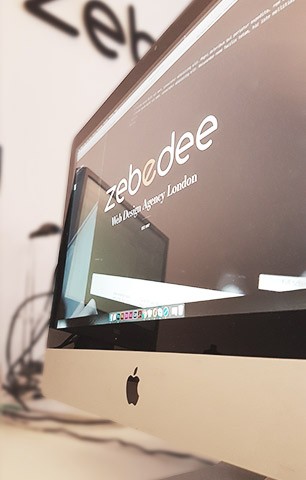
I want to click on reflection of computer monitor, so point(93,187).